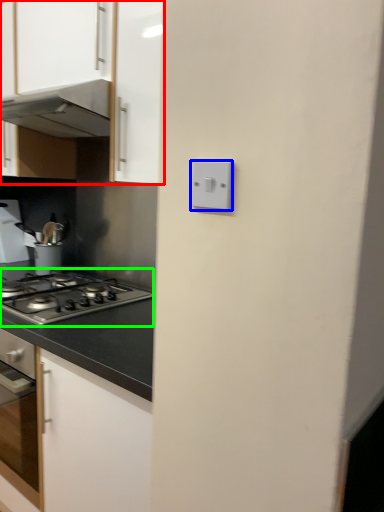
Question: Which object is the farthest from cabinetry (highlighted by a red box)? Choose among these: light switch (highlighted by a blue box) or gas stove (highlighted by a green box).

Choices:
 (A) light switch
 (B) gas stove

Answer: (A)